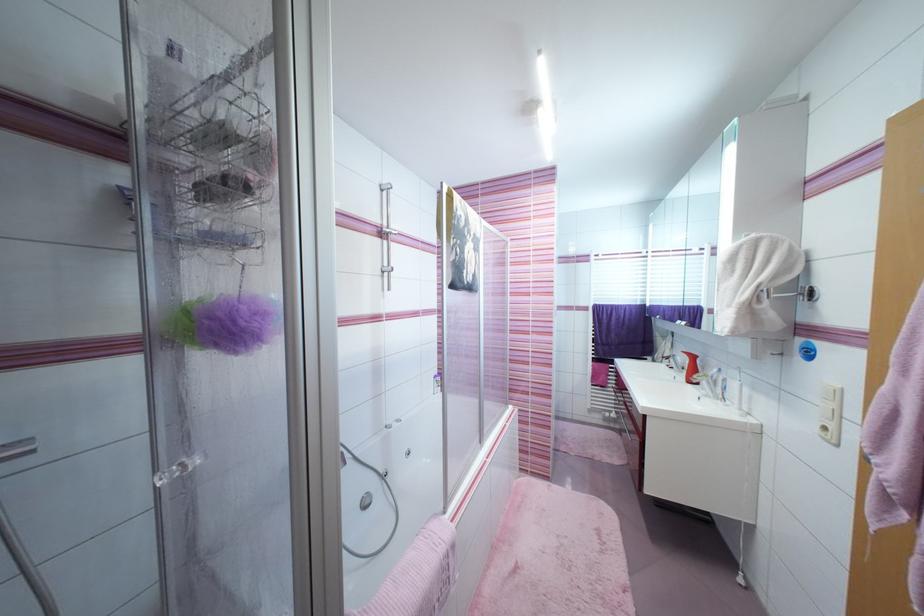
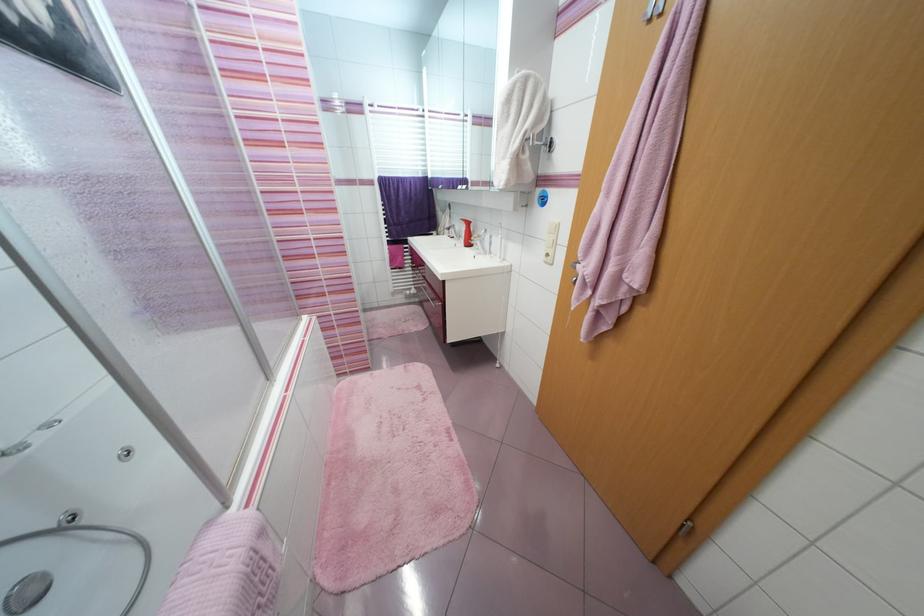
Where in the second image is the point corresponding to point (710, 384) from the first image?

(483, 244)